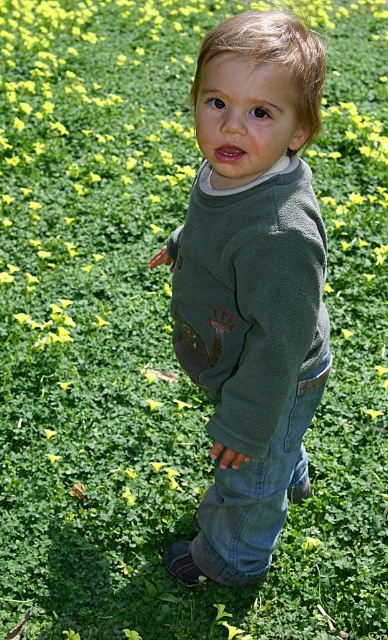
Who is positioned more to the left, green matte sweater at center or jeans at lower center?

green matte sweater at center

Between green matte sweater at center and jeans at lower center, which one is positioned higher?

green matte sweater at center is above.

Between point (178, 573) and point (289, 406), which one is positioned behind?

Point (178, 573)

The image size is (388, 640). Find the location of `green matte sweater at center`. green matte sweater at center is located at coordinates (251, 285).